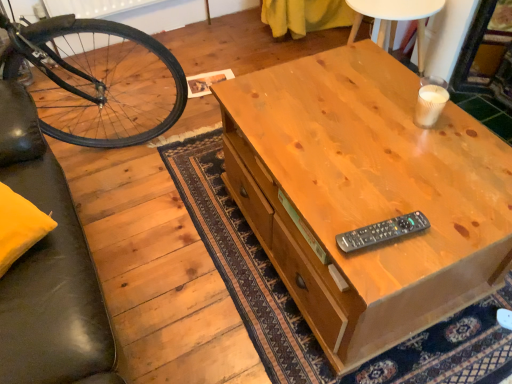
This screenshot has height=384, width=512. What are the coordinates of `free space to the left of white paper cup at upper right` in the screenshot? It's located at (367, 120).